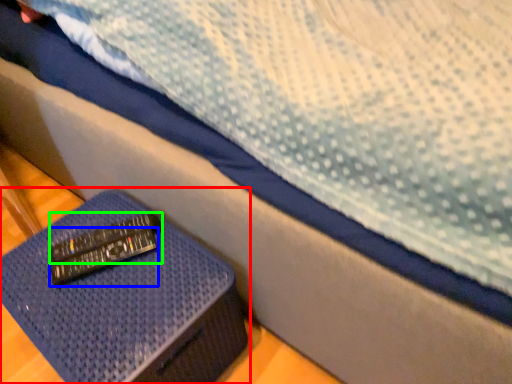
Question: Considering the real-world distances, which object is farthest from furniture (highlighted by a red box)? remote (highlighted by a blue box) or remote (highlighted by a green box)?

Choices:
 (A) remote
 (B) remote

Answer: (B)